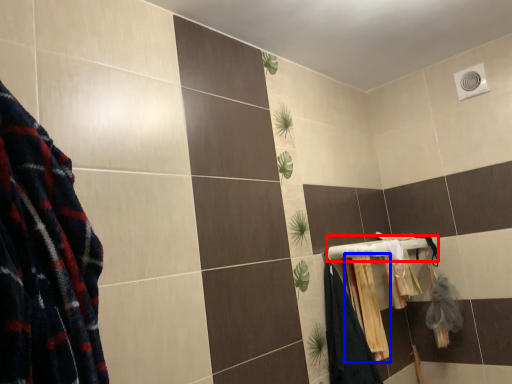
Question: Among these objects, which one is farthest to the camera, towel bar (highlighted by a red box) or bath towel (highlighted by a blue box)?

Choices:
 (A) towel bar
 (B) bath towel

Answer: (B)